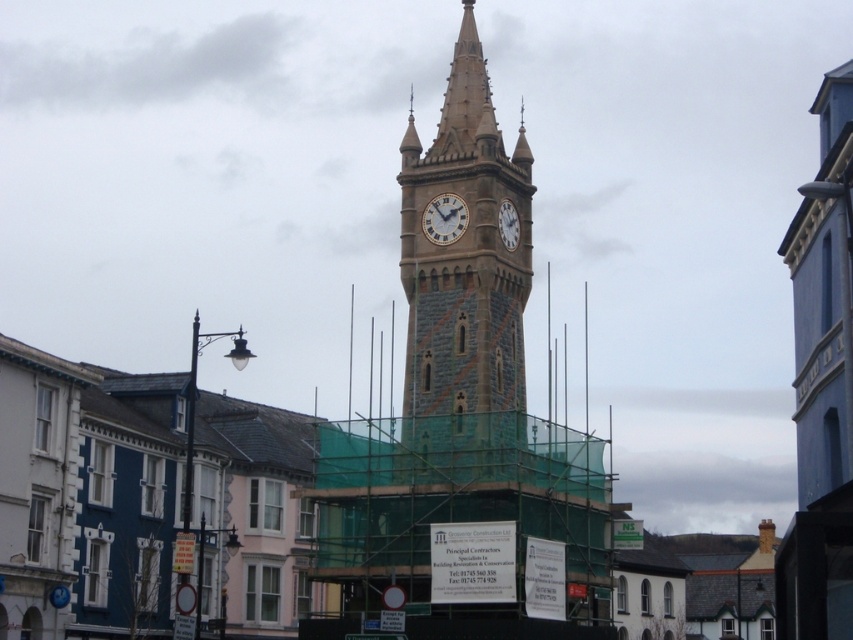
Which is behind, point (503, 250) or point (431, 234)?

Positioned behind is point (431, 234).

Is stone clock tower at center further to camera compared to white painted clock face at center?

No, it is in front of white painted clock face at center.

You are a GUI agent. You are given a task and a screenshot of the screen. Output one action in this format:
    pyautogui.click(x=<x>, y=<y>)
    Task: Click on the stone clock tower at center
    Image resolution: width=853 pixels, height=640 pixels.
    Given the screenshot: What is the action you would take?
    pyautogui.click(x=463, y=264)

Who is shorter, stone clock tower at center or white textured clock at center?

white textured clock at center

At what (x,y) coordinates should I click in order to perform the action: click on stone clock tower at center. Please return your answer as a coordinate pair (x, y). This screenshot has height=640, width=853. Looking at the image, I should click on (463, 264).

You are a GUI agent. You are given a task and a screenshot of the screen. Output one action in this format:
    pyautogui.click(x=<x>, y=<y>)
    Task: Click on the stone clock tower at center
    
    Given the screenshot: What is the action you would take?
    pyautogui.click(x=463, y=264)

Between point (450, 196) and point (514, 214), which one is positioned in front?

Point (450, 196) is more forward.

Is white painted clock face at center to the left of white textured clock at center from the viewer's perspective?

Yes, white painted clock face at center is to the left of white textured clock at center.

Image resolution: width=853 pixels, height=640 pixels. What do you see at coordinates (444, 218) in the screenshot? I see `white painted clock face at center` at bounding box center [444, 218].

Locate an element on the screen. The image size is (853, 640). white painted clock face at center is located at coordinates (444, 218).